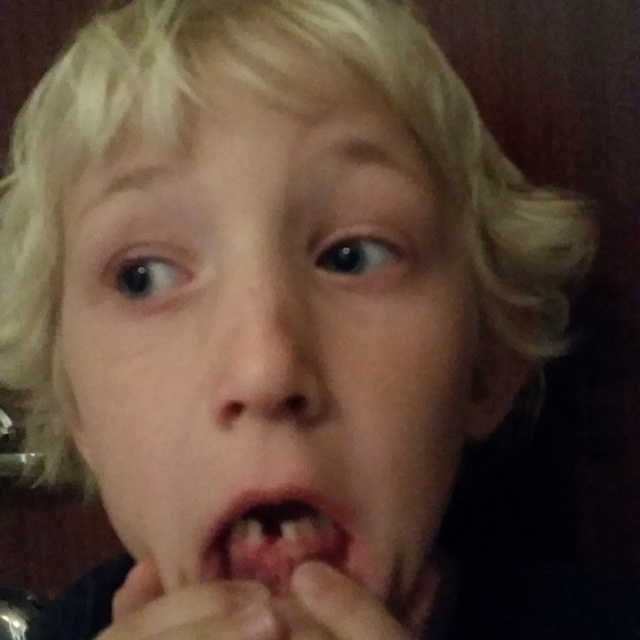
Can you confirm if smooth skin face at center is positioned to the left of pink flesh at center?

Indeed, smooth skin face at center is positioned on the left side of pink flesh at center.

Does smooth skin face at center have a lesser width compared to pink flesh at center?

No, smooth skin face at center is not thinner than pink flesh at center.

Is point (104, 310) positioned after point (321, 557)?

Yes, it is.

You are a GUI agent. You are given a task and a screenshot of the screen. Output one action in this format:
    pyautogui.click(x=<x>, y=<y>)
    Task: Click on the smooth skin face at center
    The image size is (640, 640).
    Given the screenshot: What is the action you would take?
    pyautogui.click(x=273, y=340)

Can you confirm if pink flesh at center is shorter than smooth skin hand at lower center?

No.

Is the position of pink flesh at center more distant than that of smooth skin hand at lower center?

Yes, pink flesh at center is behind smooth skin hand at lower center.

Is point (291, 538) more distant than point (145, 630)?

Yes, it is behind point (145, 630).

You are a GUI agent. You are given a task and a screenshot of the screen. Output one action in this format:
    pyautogui.click(x=<x>, y=<y>)
    Task: Click on the pink flesh at center
    The width and height of the screenshot is (640, 640).
    Given the screenshot: What is the action you would take?
    pyautogui.click(x=278, y=536)

Is smooth skin face at center positioned at the back of smooth skin hand at lower center?

Yes, it is.

Between smooth skin face at center and smooth skin hand at lower center, which one is positioned lower?

Positioned lower is smooth skin hand at lower center.

Which is in front, point (308, 561) or point (186, 605)?

Positioned in front is point (186, 605).

Where is `smooth skin face at center`? This screenshot has width=640, height=640. smooth skin face at center is located at coordinates click(273, 340).